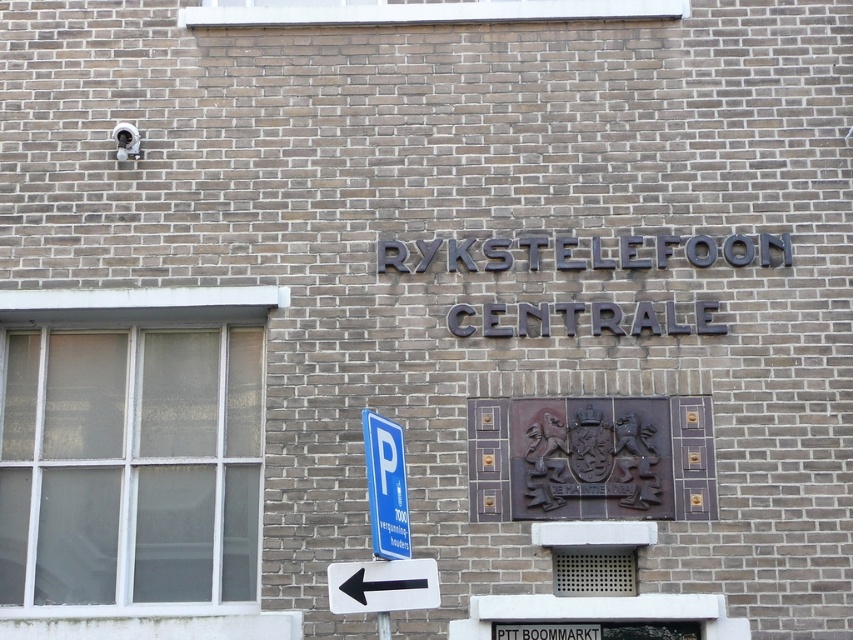
Question: Is blue plastic parking sign at lower left closer to camera compared to blue metallic parking sign at lower left?

Choices:
 (A) yes
 (B) no

Answer: (A)

Question: Which of the following is the farthest from the observer?

Choices:
 (A) blue plastic parking sign at lower left
 (B) black plastic arrow at lower left

Answer: (B)

Question: Which is nearer to the blue metallic parking sign at lower left?

Choices:
 (A) black plastic arrow at lower left
 (B) blue plastic parking sign at lower left

Answer: (B)

Question: Is blue plastic parking sign at lower left above black plastic arrow at lower left?

Choices:
 (A) yes
 (B) no

Answer: (A)

Question: Considering the real-world distances, which object is farthest from the black plastic arrow at lower left?

Choices:
 (A) blue plastic parking sign at lower left
 (B) blue metallic parking sign at lower left

Answer: (B)

Question: Can you confirm if blue plastic parking sign at lower left is positioned above blue metallic parking sign at lower left?

Choices:
 (A) no
 (B) yes

Answer: (B)